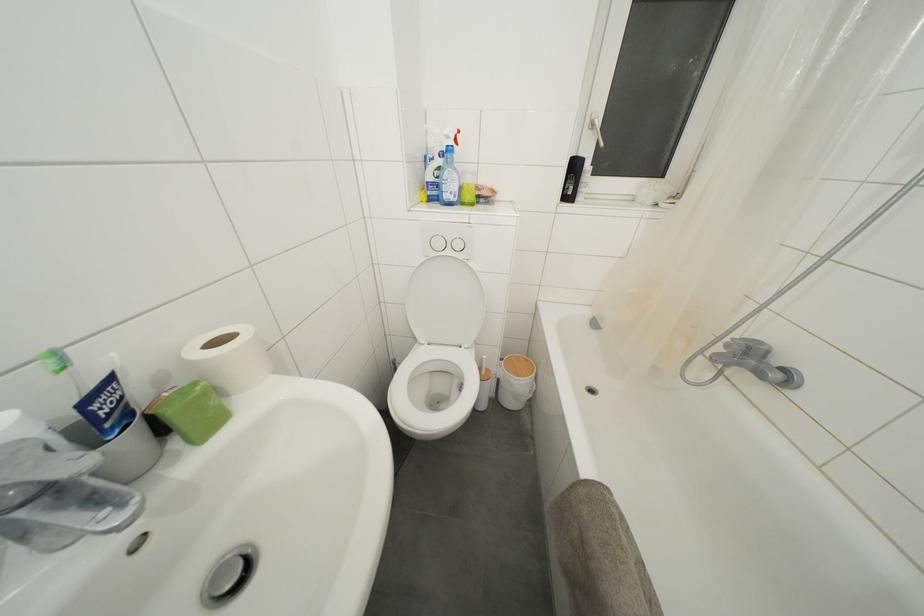
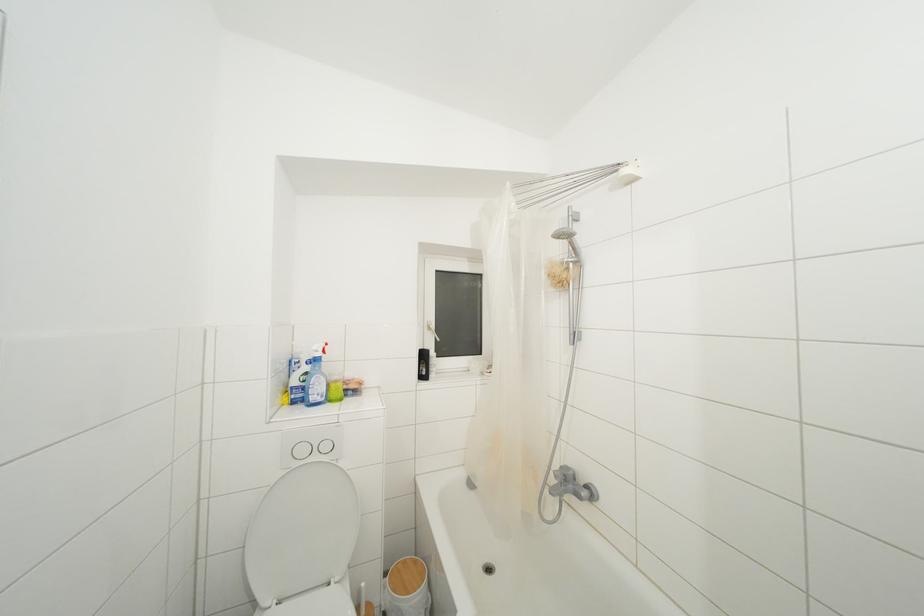
Question: I am providing you with two images of the same scene from different viewpoints. After the viewpoint changes to image2, which objects are now occluded?

Choices:
 (A) white window handle
 (B) toilet flush button
 (C) black plastic bottle
 (D) none of these

Answer: (D)